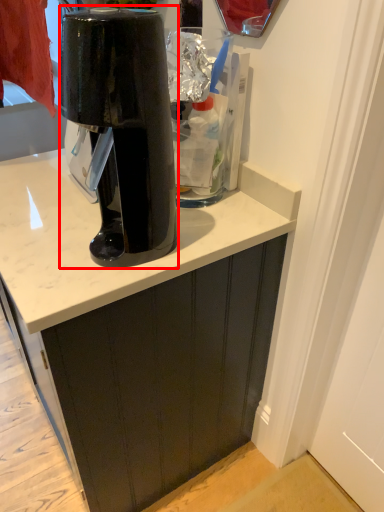
Question: From the image's perspective, where is home appliance (annotated by the red box) located relative to cabinetry?

Choices:
 (A) below
 (B) above

Answer: (B)